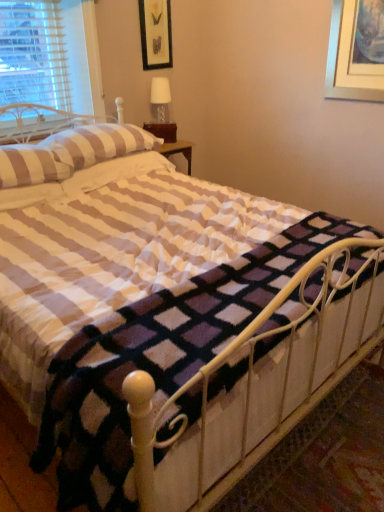
Question: Is the position of striped fabric pillow at upper left, which is the 1th pillow in front-to-back order, less distant than that of black matte picture frame at upper center?

Choices:
 (A) no
 (B) yes

Answer: (B)

Question: Can you confirm if striped fabric pillow at upper left, the 3th pillow in the back-to-front sequence, is bigger than black matte picture frame at upper center?

Choices:
 (A) no
 (B) yes

Answer: (B)

Question: Can you confirm if striped fabric pillow at upper left, the 3th pillow in the back-to-front sequence, is thinner than black matte picture frame at upper center?

Choices:
 (A) yes
 (B) no

Answer: (B)

Question: Is striped fabric pillow at upper left, which is the 1th pillow in front-to-back order, wider than black matte picture frame at upper center?

Choices:
 (A) yes
 (B) no

Answer: (A)

Question: Is striped fabric pillow at upper left, the 3th pillow in the back-to-front sequence, oriented away from black matte picture frame at upper center?

Choices:
 (A) yes
 (B) no

Answer: (B)

Question: Considering their positions, is white metal bed frame at center located in front of or behind striped fabric pillow at upper left, the 3th pillow in the back-to-front sequence?

Choices:
 (A) behind
 (B) front

Answer: (B)

Question: Is white metal bed frame at center bigger or smaller than striped fabric pillow at upper left, the 3th pillow in the back-to-front sequence?

Choices:
 (A) big
 (B) small

Answer: (A)

Question: Is point (124, 378) closer or farther from the camera than point (52, 170)?

Choices:
 (A) closer
 (B) farther

Answer: (A)

Question: From their relative heights in the image, would you say white metal bed frame at center is taller or shorter than striped fabric pillow at upper left, the 3th pillow in the back-to-front sequence?

Choices:
 (A) short
 (B) tall

Answer: (B)

Question: Considering their positions, is black matte picture frame at upper center located in front of or behind white metal bed frame at center?

Choices:
 (A) front
 (B) behind

Answer: (B)

Question: Considering the positions of black matte picture frame at upper center and white metal bed frame at center in the image, is black matte picture frame at upper center taller or shorter than white metal bed frame at center?

Choices:
 (A) short
 (B) tall

Answer: (B)

Question: In terms of size, does black matte picture frame at upper center appear bigger or smaller than white metal bed frame at center?

Choices:
 (A) big
 (B) small

Answer: (B)

Question: Considering the positions of black matte picture frame at upper center and white metal bed frame at center in the image, is black matte picture frame at upper center wider or thinner than white metal bed frame at center?

Choices:
 (A) thin
 (B) wide

Answer: (A)

Question: Is point (36, 160) closer or farther from the camera than point (152, 2)?

Choices:
 (A) farther
 (B) closer

Answer: (B)

Question: From a real-world perspective, is striped fabric pillow at upper left, the 3th pillow in the back-to-front sequence, above or below black matte picture frame at upper center?

Choices:
 (A) below
 (B) above

Answer: (A)